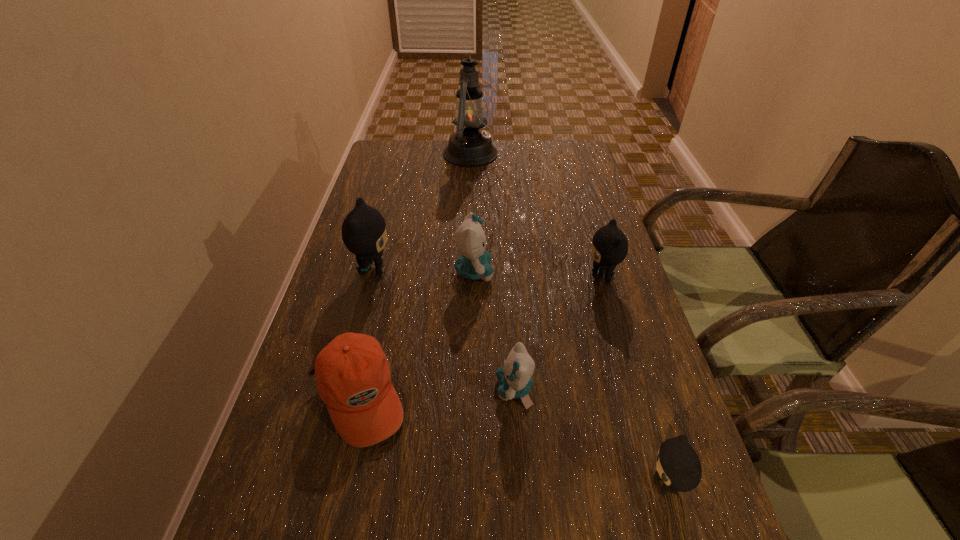
This screenshot has width=960, height=540. In order to click on free region that satisfies the following two spatial constraints: 1. on the face of the bigger blue kitten; 2. on the front side of the baseball cap in this screenshot , I will do `click(472, 396)`.

The image size is (960, 540). Find the location of `free location that satisfies the following two spatial constraints: 1. on the front-facing side of the second smallest gray kitten; 2. on the front side of the baseball cap`. free location that satisfies the following two spatial constraints: 1. on the front-facing side of the second smallest gray kitten; 2. on the front side of the baseball cap is located at coordinates (637, 396).